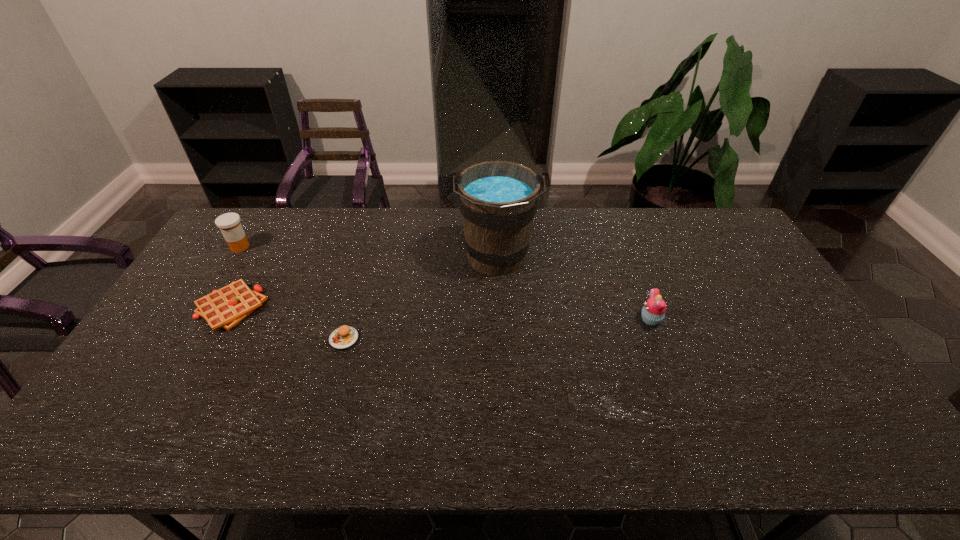
This screenshot has width=960, height=540. In order to click on vacant space that satisfies the following two spatial constraints: 1. on the label of the patty; 2. on the right side of the medicine in this screenshot , I will do `click(182, 339)`.

Identify the location of free space in the image that satisfies the following two spatial constraints: 1. on the label of the waffle; 2. on the right side of the medicine. (202, 308).